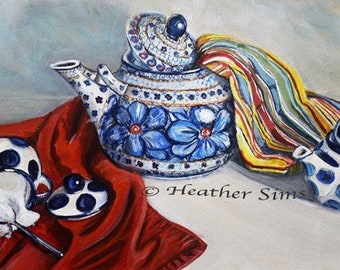
You are a GUI agent. You are given a task and a screenshot of the screen. Output one action in this format:
    pyautogui.click(x=<x>, y=<y>)
    Task: Click on the wall
    Image resolution: width=340 pixels, height=270 pixels.
    Given the screenshot: What is the action you would take?
    pyautogui.click(x=102, y=40)